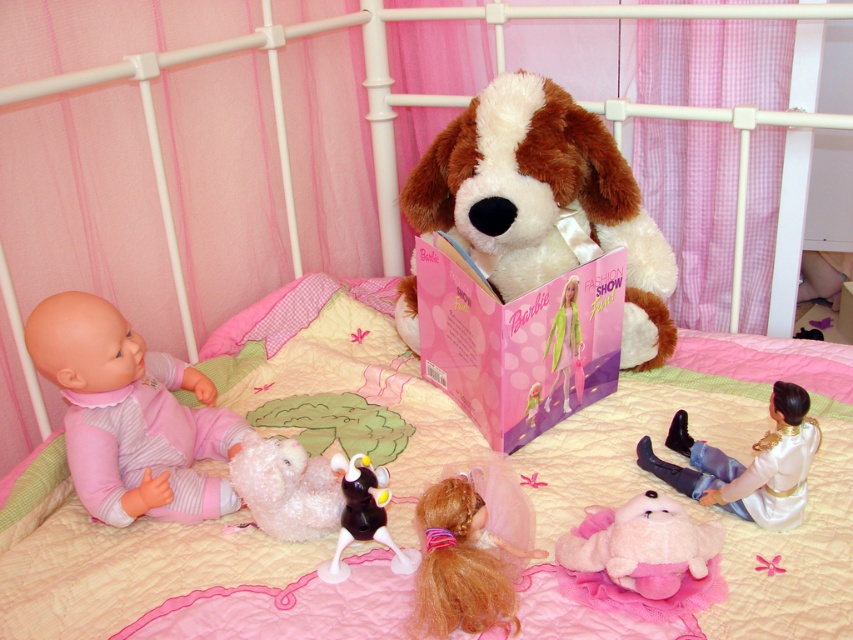
You are a child trying to reach both the shiny pink tulle skirt at lower center and the shiny plastic cow at center from your current position. Which object is closer to you?

The shiny pink tulle skirt at lower center is closer to you since it is only 3.81 inches away from the shiny plastic cow at center, but without knowing your exact position, it is impossible to determine which is closer.

You are a child looking at the bed with a white metal frame and pink curtains. You see a shiny pink tulle skirt represented by point [461,564]. Where is the shiny pink tulle skirt located relative to the bed?

The shiny pink tulle skirt is at the lower center of the bed.